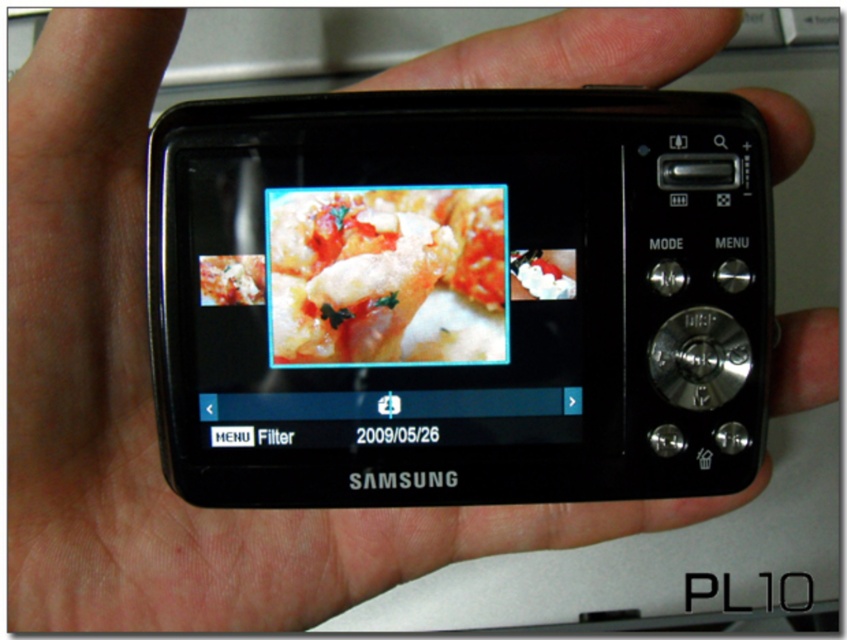
Consider the image. You are a photographer using the Samsung PL10 camera. You notice two points on the camera body, one at point (737, 301) and another at point (394, 321). Which point is closer to you when you are holding the camera?

Point (737, 301) is in front of point (394, 321), so the point at (737, 301) is closer to you when holding the camera.

You are a photographer reviewing a photo on your Samsung PL10 camera. You notice two elements at the center of your viewfinder screen. Which one is positioned lower between the black glossy screen at center and the shiny tomato sauce at center?

The black glossy screen at center is positioned below the shiny tomato sauce at center, so the black glossy screen at center is lower.

You are a photographer checking the display of your Samsung PL10 camera. You notice both the black glossy screen at center and the shiny tomato sauce at center in the photo. Which one appears bigger on the camera screen?

The black glossy screen at center has a larger size compared to the shiny tomato sauce at center, so the black glossy screen at center appears bigger on the camera screen.